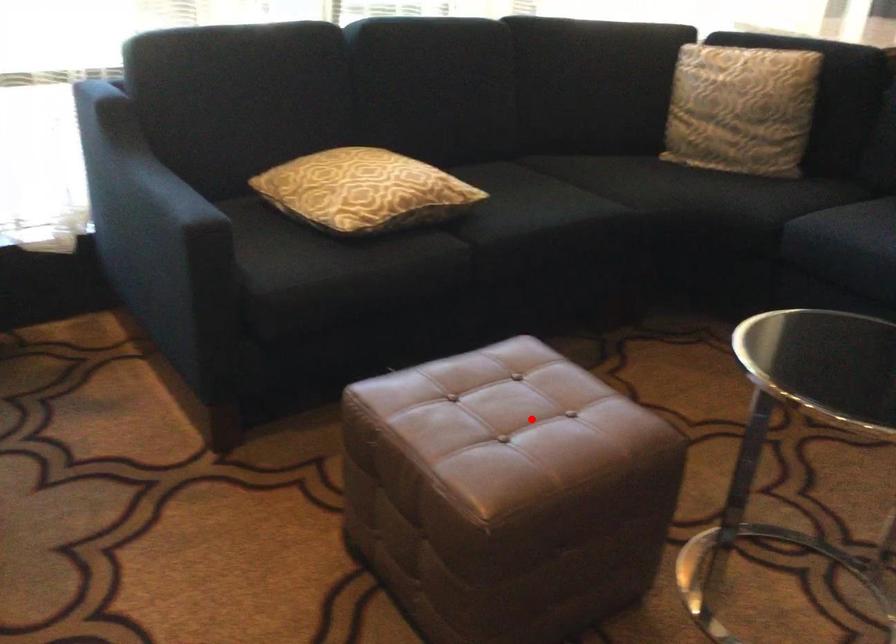
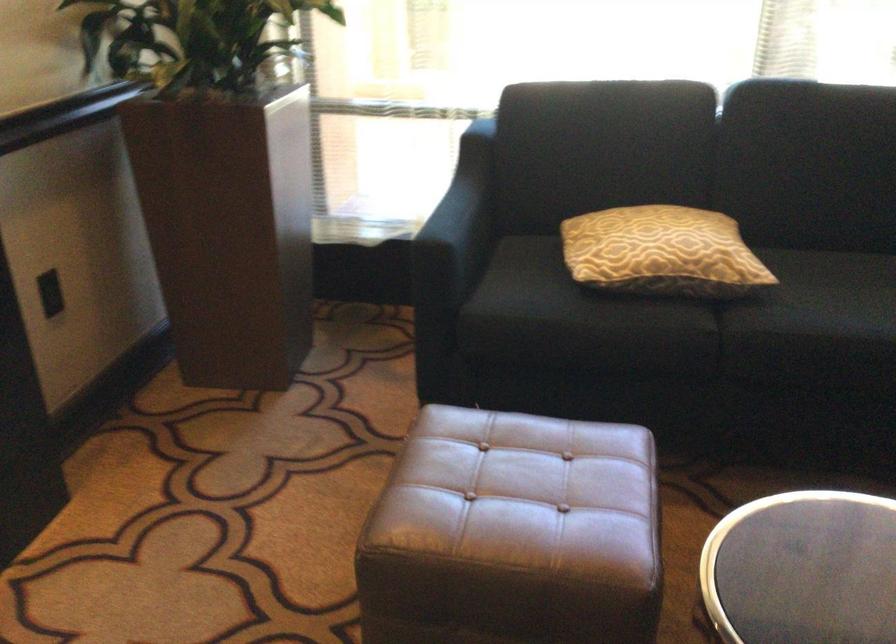
In the second image, find the point that corresponds to the highlighted location in the first image.

(522, 495)